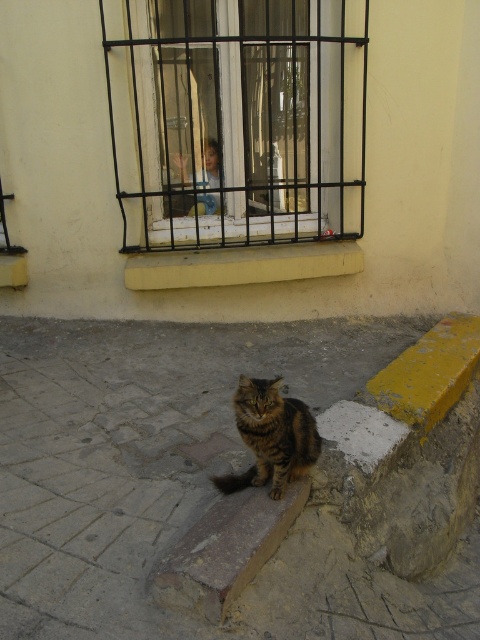
Is point (123, 273) positioned after point (251, 396)?

Yes, point (123, 273) is farther from viewer.

Locate an element on the screen. This screenshot has height=640, width=480. yellow concrete at center is located at coordinates (241, 264).

Identify the location of yellow concrete at center. (241, 264).

Identify the location of yellow concrete at center. (241, 264).

Is smooth concrete pavement at lower center smaller than tabby fur cat at center?

Actually, smooth concrete pavement at lower center might be larger than tabby fur cat at center.

Does smooth concrete pavement at lower center appear on the left side of tabby fur cat at center?

Yes, smooth concrete pavement at lower center is to the left of tabby fur cat at center.

Identify the location of smooth concrete pavement at lower center. The height and width of the screenshot is (640, 480). (184, 481).

Where is `smooth concrete pavement at lower center`? This screenshot has height=640, width=480. smooth concrete pavement at lower center is located at coordinates (184, 481).

Is smooth concrete pavement at lower center closer to camera compared to yellow concrete at center?

Yes.

What do you see at coordinates (184, 481) in the screenshot?
I see `smooth concrete pavement at lower center` at bounding box center [184, 481].

Does point (477, 556) come closer to viewer compared to point (158, 273)?

That is True.

This screenshot has width=480, height=640. I want to click on smooth concrete pavement at lower center, so click(x=184, y=481).